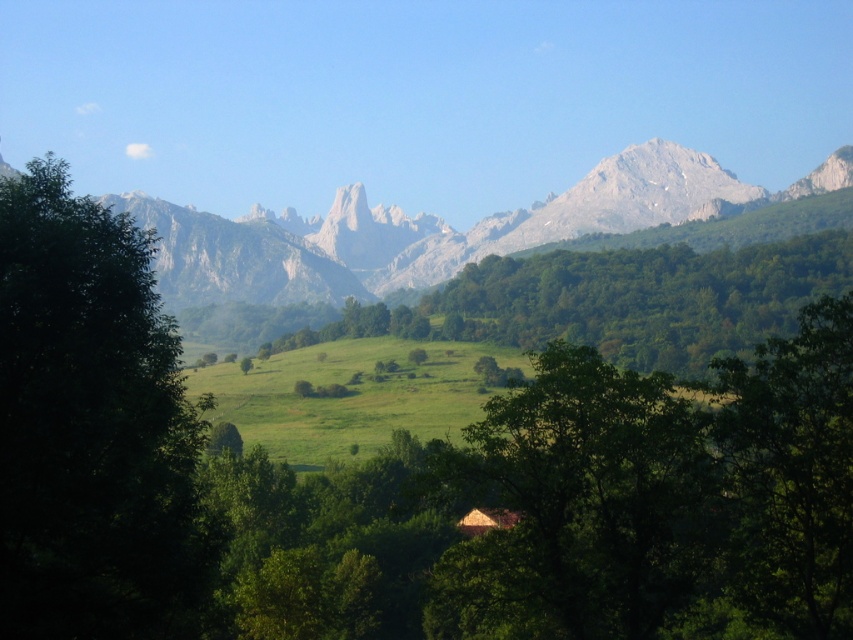
Based on the photo, you are standing in the foreground of the landscape and want to see the rocky gray mountain range at center clearly. Is the green leafy tree at left blocking your view? Please explain based on their heights.

The green leafy tree at left has a lesser height compared to the rocky gray mountain range at center, so the tree is shorter than the mountain range. Since the mountain range is taller, its peaks would still be visible above the tree, meaning the tree might partially block the lower parts but not the entire view of the rocky gray mountain range at center.

You are an outdoor photographer planning to take a photo of the green leafy tree at left and the rocky gray mountain range at center. Based on their sizes in the image, which one should you focus on first to ensure both are in frame?

The green leafy tree at left is smaller than the rocky gray mountain range at center, so you should focus on the rocky gray mountain range at center first to ensure both fit in the frame.